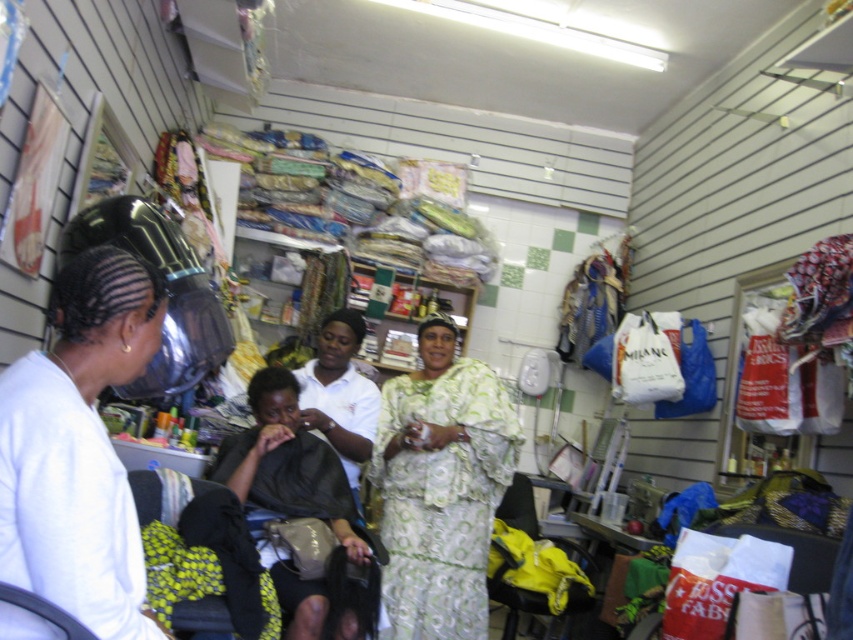
Question: Estimate the real-world distances between objects in this image. Which object is farther from the white matte hair at left?

Choices:
 (A) black fabric at center
 (B) green floral fabric dress at center
 (C) white fabric at center

Answer: (B)

Question: Is white matte hair at left smaller than green floral fabric dress at center?

Choices:
 (A) yes
 (B) no

Answer: (A)

Question: Which of these objects is positioned farthest from the white fabric at center?

Choices:
 (A) green floral fabric dress at center
 (B) white matte hair at left
 (C) black fabric at center

Answer: (B)

Question: Is green floral fabric dress at center above black fabric at center?

Choices:
 (A) no
 (B) yes

Answer: (A)

Question: Which is farther from the white matte hair at left?

Choices:
 (A) white fabric at center
 (B) green floral fabric dress at center
 (C) black fabric at center

Answer: (B)

Question: Can you confirm if black fabric at center is positioned above white fabric at center?

Choices:
 (A) yes
 (B) no

Answer: (B)